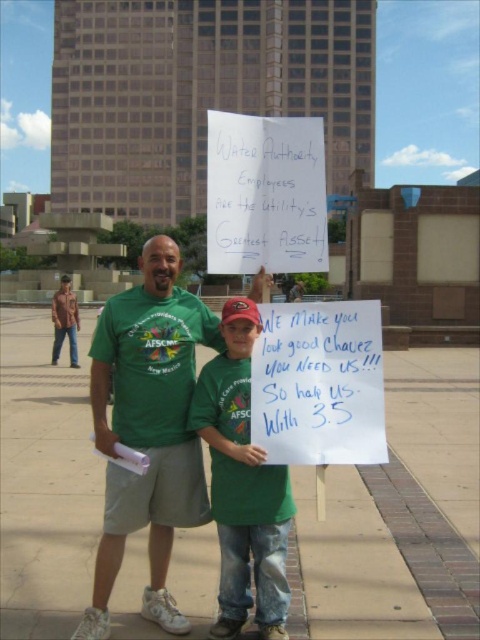
Describe the element at coordinates (242, 484) in the screenshot. I see `green matte shirt at center` at that location.

In the scene shown: Who is shorter, green matte shirt at center or jeans at left?

With less height is green matte shirt at center.

This screenshot has height=640, width=480. Find the location of `green matte shirt at center`. green matte shirt at center is located at coordinates (242, 484).

How distant is green fabric shirt at center from jeans at left?

green fabric shirt at center is 11.32 meters away from jeans at left.

Consider the image. Can you confirm if green fabric shirt at center is positioned above jeans at left?

No, green fabric shirt at center is not above jeans at left.

Is point (192, 499) farther from camera compared to point (56, 330)?

No, (192, 499) is closer to viewer.

The height and width of the screenshot is (640, 480). Find the location of `green fabric shirt at center`. green fabric shirt at center is located at coordinates (147, 428).

The width and height of the screenshot is (480, 640). What are the coordinates of `green fabric shirt at center` in the screenshot? It's located at (147, 428).

This screenshot has height=640, width=480. I want to click on green fabric shirt at center, so click(147, 428).

You are a GUI agent. You are given a task and a screenshot of the screen. Output one action in this format:
    pyautogui.click(x=<x>, y=<y>)
    Task: Click on the green fabric shirt at center
    The height and width of the screenshot is (640, 480).
    Given the screenshot: What is the action you would take?
    click(147, 428)